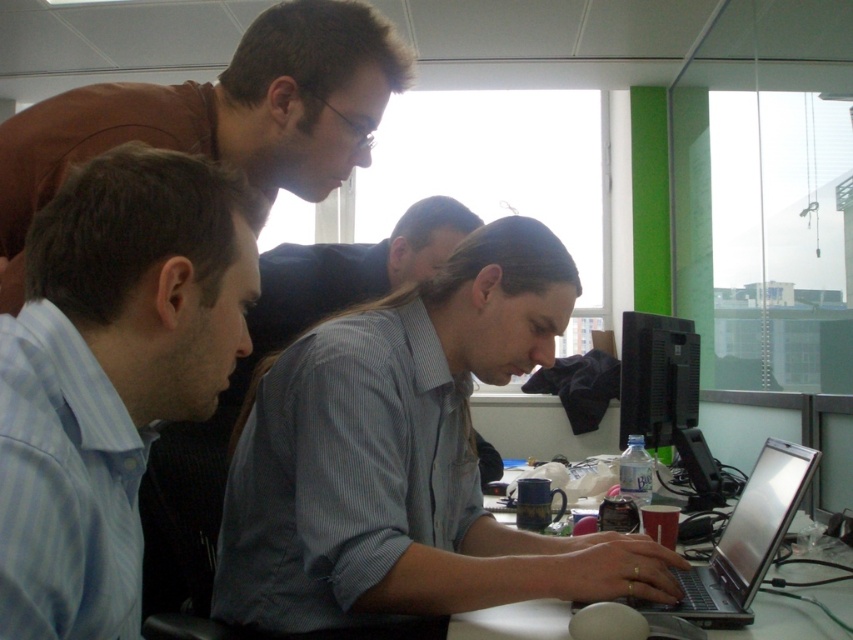
You are a delivery person who needs to place a package on the desk between the silver metallic laptop at center and the black glossy monitor at right. Can you fit the package there?

The silver metallic laptop at center is positioned on the left side of black glossy monitor at right, so there is space between them to place the package.

You are a delivery robot with a 75 cm wide package that needs to be placed between the silver metallic laptop at center and the black glossy monitor at right. Can you fit the package between them without moving either device?

The silver metallic laptop at center and black glossy monitor at right are 77.10 centimeters apart from each other. Since the package is 75 cm wide, it can fit between them as the space is slightly wider than the package.

You are trying to locate the silver metallic laptop at center in the office scene. According to the coordinates provided, where exactly is it positioned?

The silver metallic laptop at center is located at point (744, 540).